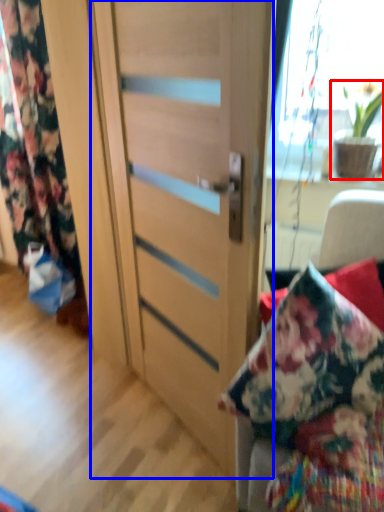
Question: Which point is further to the camera, houseplant (highlighted by a red box) or door (highlighted by a blue box)?

Choices:
 (A) houseplant
 (B) door

Answer: (A)